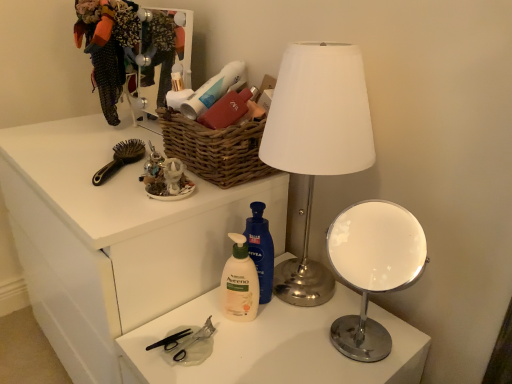
Find the location of a particular element. vacant area that lies to the right of black plastic scissors at lower center is located at coordinates (271, 343).